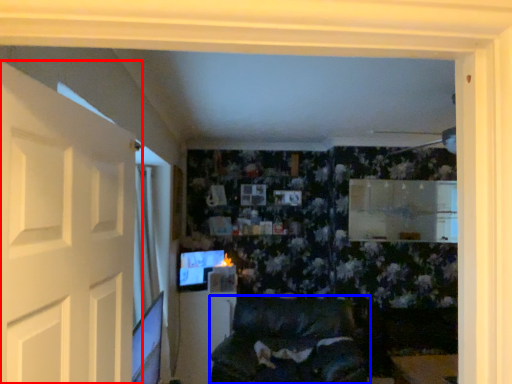
Question: Which object is closer to the camera taking this photo, door (highlighted by a red box) or furniture (highlighted by a blue box)?

Choices:
 (A) door
 (B) furniture

Answer: (A)